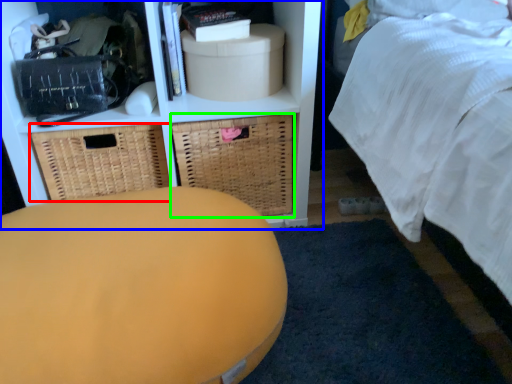
Question: Based on their relative distances, which object is nearer to basket (highlighted by a red box)? Choose from shelf (highlighted by a blue box) and basket (highlighted by a green box).

Choices:
 (A) shelf
 (B) basket

Answer: (A)